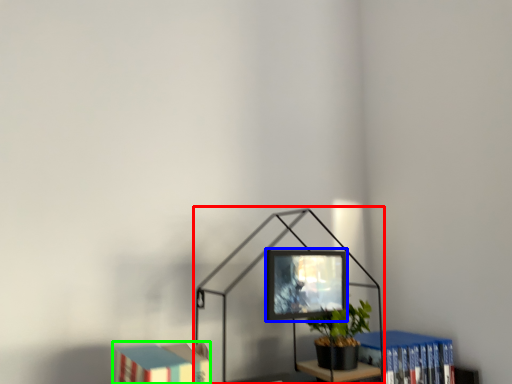
Question: Considering the real-world distances, which object is closest to table lamp (highlighted by a red box)? computer monitor (highlighted by a blue box) or book (highlighted by a green box).

Choices:
 (A) computer monitor
 (B) book

Answer: (A)